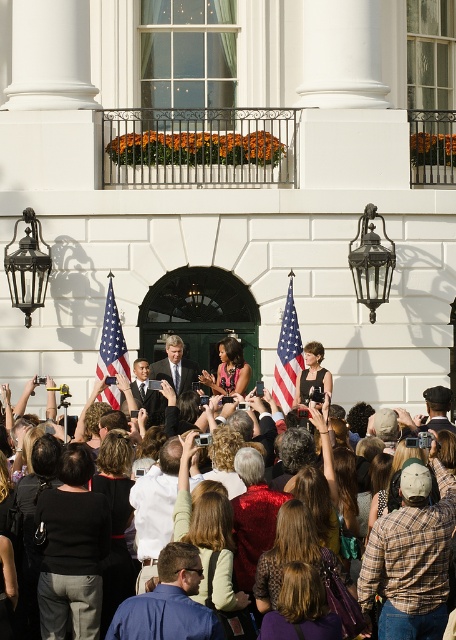
Question: Is the position of plaid shirt at center more distant than that of polished metallic flag at center?

Choices:
 (A) no
 (B) yes

Answer: (A)

Question: Which object is the farthest from the dark suit at center?

Choices:
 (A) multicolored clothing at center
 (B) dark gray suit at center

Answer: (A)

Question: Which of the following is the farthest from the observer?

Choices:
 (A) matte american flag at center
 (B) dark gray suit at center
 (C) blue shirt at lower center
 (D) polished metallic flag at center

Answer: (B)

Question: In this image, where is blue shirt at lower center located relative to dark suit at center?

Choices:
 (A) above
 (B) below

Answer: (B)

Question: Does plaid shirt at center have a smaller size compared to blue shirt at lower center?

Choices:
 (A) no
 (B) yes

Answer: (B)

Question: Which of the following is the closest to the observer?

Choices:
 (A) (119, 337)
 (B) (139, 380)

Answer: (A)